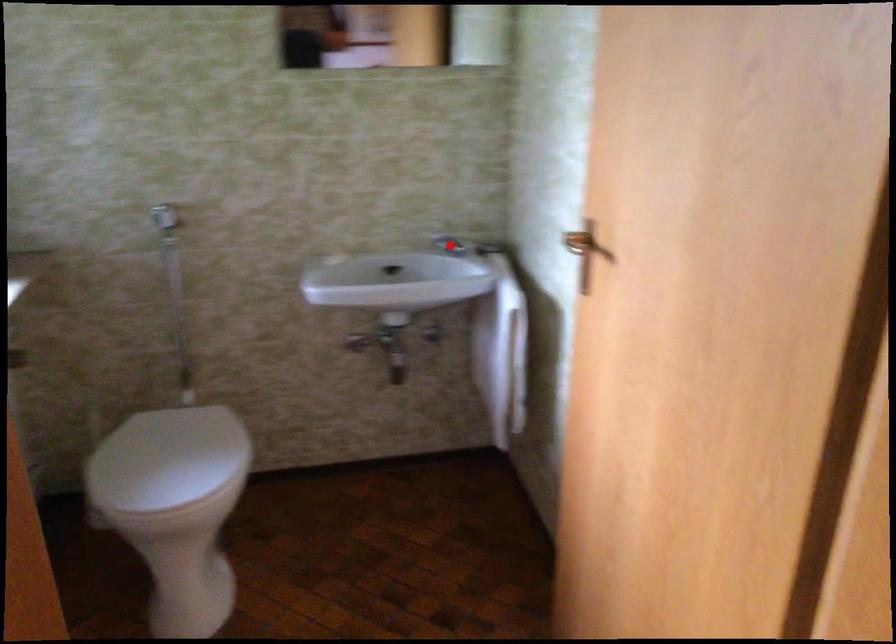
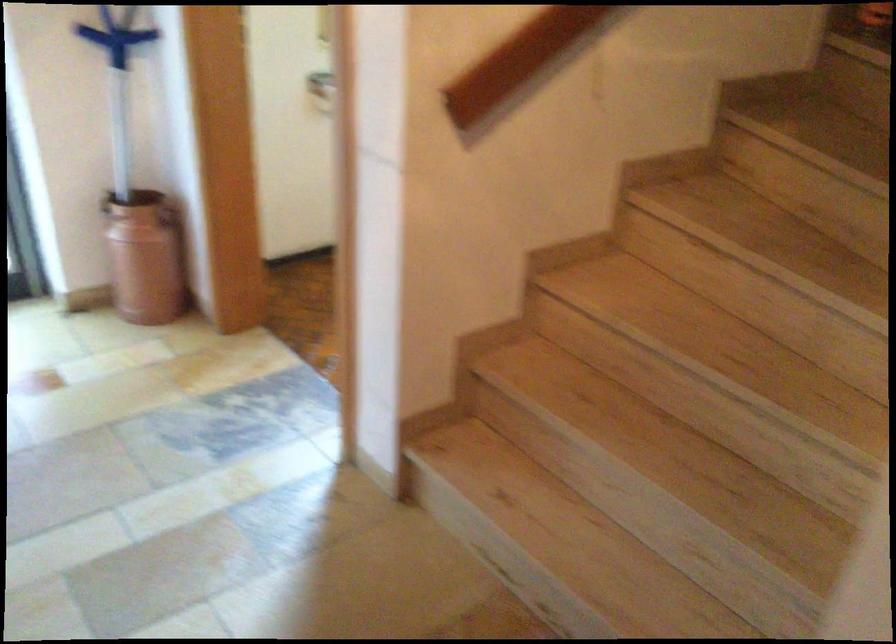
Question: I am providing you with two images of the same scene from different viewpoints. A red point is marked on the first image. Is the red point's position out of view in image 2?

Choices:
 (A) Yes
 (B) No

Answer: (A)